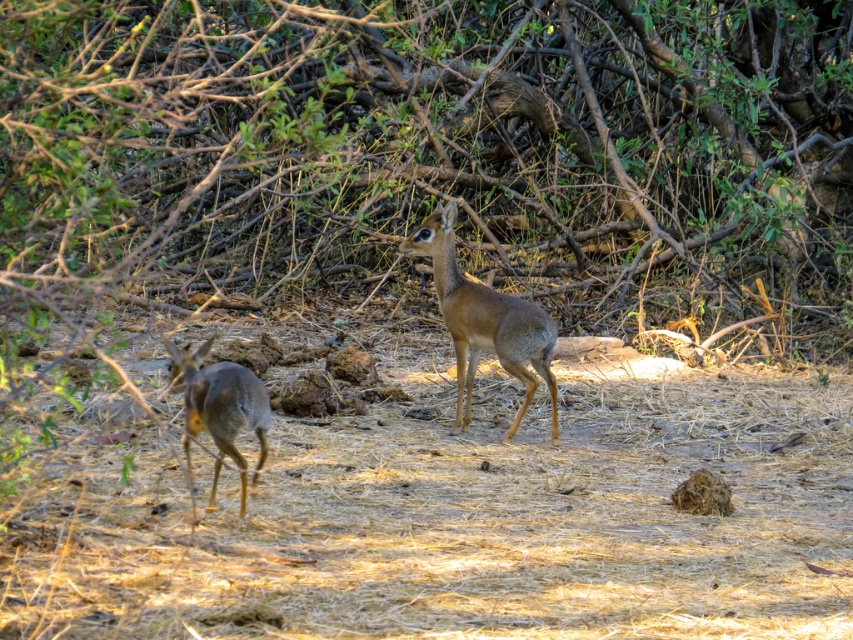
Question: Can you confirm if brown furry deer at center is positioned above brown fur deer at left?

Choices:
 (A) yes
 (B) no

Answer: (A)

Question: Which point appears farthest from the camera in this image?

Choices:
 (A) (554, 408)
 (B) (225, 452)

Answer: (A)

Question: Does brown furry deer at center have a lesser width compared to brown fur deer at left?

Choices:
 (A) yes
 (B) no

Answer: (B)

Question: From the image, what is the correct spatial relationship of brown furry deer at center in relation to brown fur deer at left?

Choices:
 (A) right
 (B) left

Answer: (A)

Question: Which object is closer to the camera taking this photo?

Choices:
 (A) brown furry deer at center
 (B) brown fur deer at left

Answer: (B)